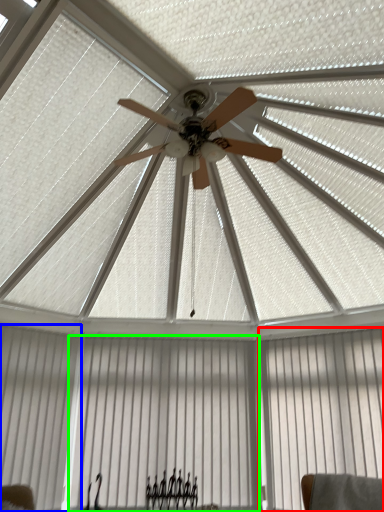
Question: Which object is the closest to the curtain (highlighted by a red box)? Choose among these: shutter (highlighted by a blue box) or curtain (highlighted by a green box).

Choices:
 (A) shutter
 (B) curtain

Answer: (B)